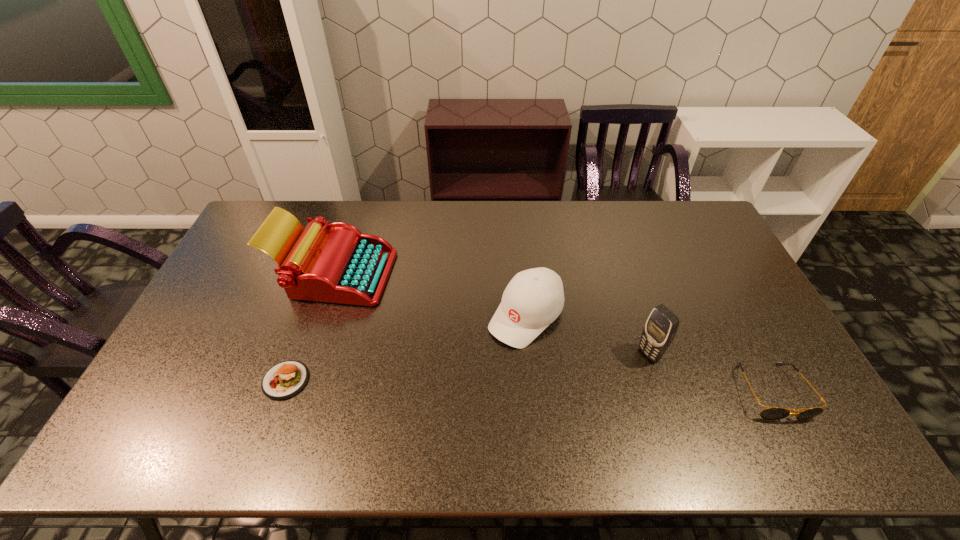
Find the location of `the shortest object`. the shortest object is located at coordinates (284, 380).

At what (x,y) coordinates should I click in order to perform the action: click on the second shortest object. Please return your answer as a coordinate pair (x, y). Looking at the image, I should click on (771, 413).

Where is `the rightmost object`? The height and width of the screenshot is (540, 960). the rightmost object is located at coordinates (771, 413).

Where is `cellular telephone`? The width and height of the screenshot is (960, 540). cellular telephone is located at coordinates (661, 326).

Where is `baseball cap`? Image resolution: width=960 pixels, height=540 pixels. baseball cap is located at coordinates (534, 298).

Identify the location of the third tallest object. (534, 298).

I want to click on typewriter, so click(343, 265).

I want to click on free space located on the right of the patty (food), so click(x=444, y=380).

The image size is (960, 540). Find the location of `free location located 0.230m on the front face of the fourth object from left to right`. free location located 0.230m on the front face of the fourth object from left to right is located at coordinates [575, 396].

You are a GUI agent. You are given a task and a screenshot of the screen. Output one action in this format:
    pyautogui.click(x=<x>, y=<y>)
    Task: Click on the vacant space located on the front face of the fourth object from left to right
    Image resolution: width=960 pixels, height=540 pixels.
    Given the screenshot: What is the action you would take?
    pyautogui.click(x=628, y=367)